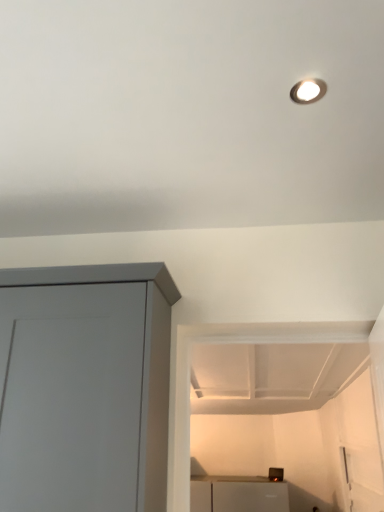
Question: Is matte gray cupboard at left in front of or behind metallic silver toaster at lower center in the image?

Choices:
 (A) behind
 (B) front

Answer: (B)

Question: From their relative heights in the image, would you say matte gray cupboard at left is taller or shorter than metallic silver toaster at lower center?

Choices:
 (A) short
 (B) tall

Answer: (B)

Question: From the image's perspective, is matte gray cupboard at left located above or below metallic silver toaster at lower center?

Choices:
 (A) below
 (B) above

Answer: (B)

Question: Choose the correct answer: Is metallic silver toaster at lower center inside matte gray cupboard at left or outside it?

Choices:
 (A) outside
 (B) inside

Answer: (A)

Question: Would you say metallic silver toaster at lower center is to the left or to the right of matte gray cupboard at left in the picture?

Choices:
 (A) right
 (B) left

Answer: (A)

Question: From the image's perspective, is metallic silver toaster at lower center positioned above or below matte gray cupboard at left?

Choices:
 (A) below
 (B) above

Answer: (A)

Question: From a real-world perspective, relative to matte gray cupboard at left, is metallic silver toaster at lower center vertically above or below?

Choices:
 (A) above
 (B) below

Answer: (B)